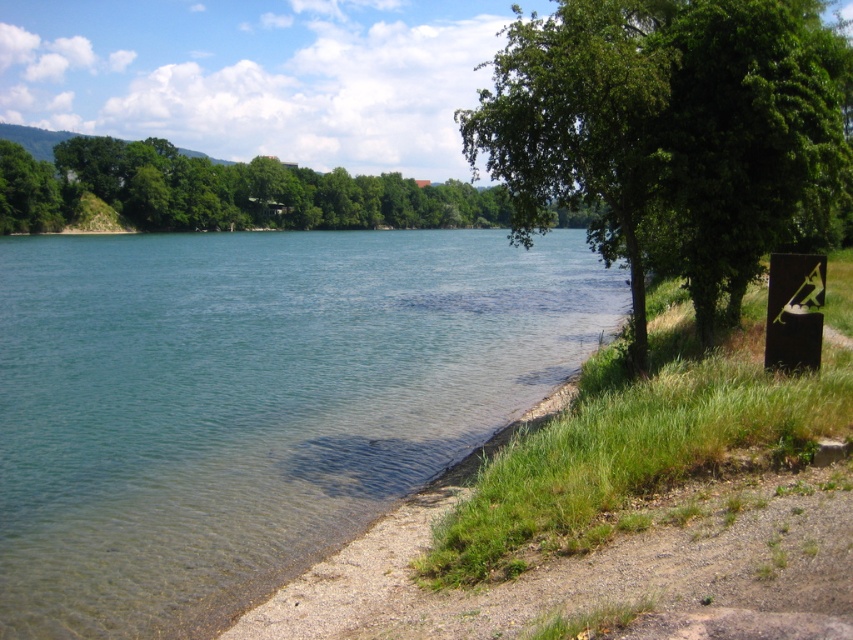
You are planning to install a solar panel array in the field near the clear water at shore left and the green leafy tree at upper left. The solar panels require a minimum of 50 meters of space between them and any trees to avoid shading. Based on the scene description, will the proposed location meet the shading requirements?

The distance between the clear water at shore left and the green leafy tree at upper left is 52.60 meters, which exceeds the minimum required 50 meters. Therefore, the proposed location meets the shading requirements as the distance is sufficient to avoid shading from the tree.

You are planning to set up a picnic area in the lakeside scene. You want to choose a spot that is closer to the water while avoiding the shade of the trees. Which tree, the green leafy tree at center or the green leafy tree at upper left, would cast a smaller shadow and allow you to have more sunlight for your picnic?

The green leafy tree at center has a lesser width compared to the green leafy tree at upper left, so it would cast a smaller shadow. Therefore, setting up the picnic near the green leafy tree at center would provide more sunlight.

You are a hiker who wants to cross the lake from the shore. You notice the clear water at shore left and the green leafy tree at upper left. Which direction should you head to avoid deeper water?

You should head towards the clear water at shore left, as it is located below the green leafy tree at upper left, indicating it is closer to the shore and likely shallower.